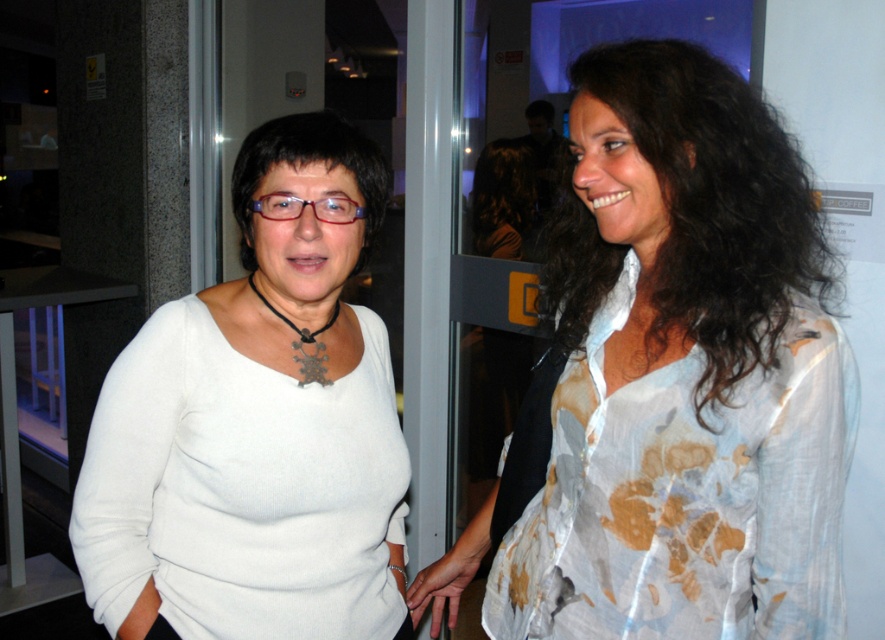
Is white matte sweater at center closer to the viewer compared to black curly hair at upper right?

No, white matte sweater at center is behind black curly hair at upper right.

Which is in front, point (314, 532) or point (703, 77)?

Point (703, 77) is in front.

Locate an element on the screen. The width and height of the screenshot is (885, 640). white matte sweater at center is located at coordinates (258, 424).

You are a GUI agent. You are given a task and a screenshot of the screen. Output one action in this format:
    pyautogui.click(x=<x>, y=<y>)
    Task: Click on the white matte sweater at center
    
    Given the screenshot: What is the action you would take?
    pyautogui.click(x=258, y=424)

Does white matte sweater at center appear on the left side of black matte hair at center?

Indeed, white matte sweater at center is positioned on the left side of black matte hair at center.

What do you see at coordinates (258, 424) in the screenshot? This screenshot has height=640, width=885. I see `white matte sweater at center` at bounding box center [258, 424].

Where is `white matte sweater at center`? The height and width of the screenshot is (640, 885). white matte sweater at center is located at coordinates pos(258,424).

Locate an element on the screen. This screenshot has height=640, width=885. white matte sweater at center is located at coordinates (258, 424).

Does white sheer blouse at right have a lesser height compared to black matte hair at center?

No.

Which is below, white sheer blouse at right or black matte hair at center?

white sheer blouse at right is below.

Where is `white sheer blouse at right`? The height and width of the screenshot is (640, 885). white sheer blouse at right is located at coordinates (675, 380).